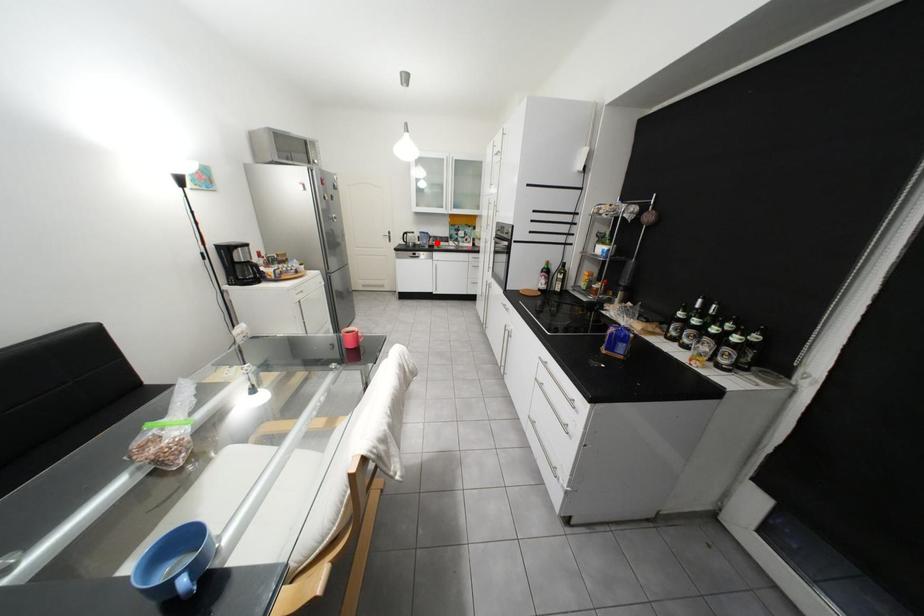
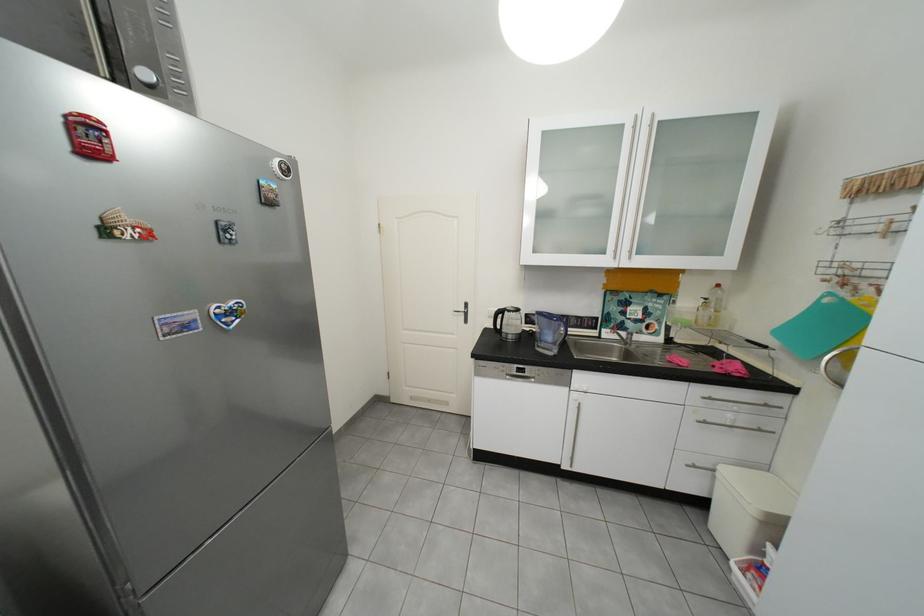
Question: I am providing you with two images of the same scene from different viewpoints. In image1, a red point is highlighted. Considering the same 3D point in image2, which of the following is correct?

Choices:
 (A) It is closer
 (B) It is farther

Answer: (B)